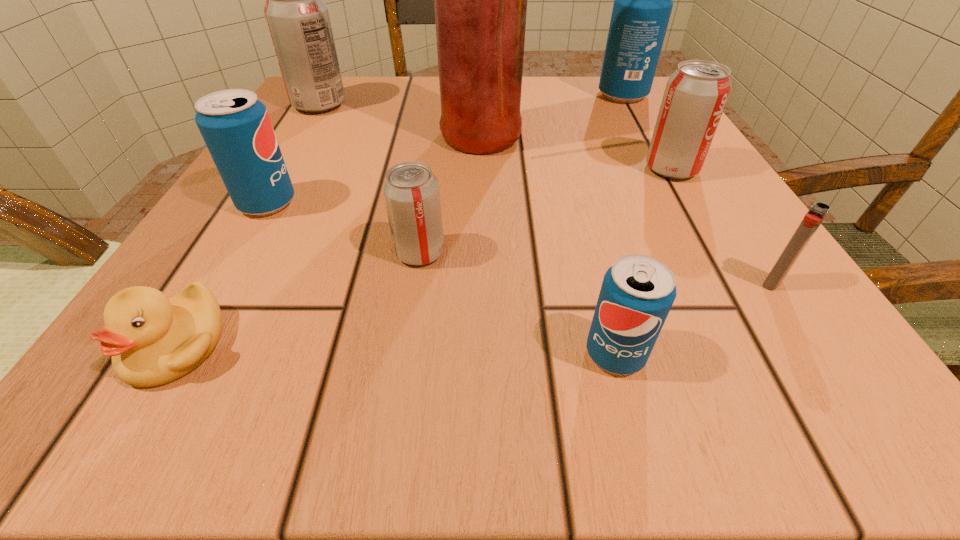
Where is `the nearest blue soda can`? the nearest blue soda can is located at coordinates (638, 291).

Image resolution: width=960 pixels, height=540 pixels. What are the coordinates of `the smallest blue soda can` in the screenshot? It's located at (638, 291).

Image resolution: width=960 pixels, height=540 pixels. Identify the location of the smallest gray soda can. (411, 191).

Find the location of a particular element. the third soda can from left to right is located at coordinates (411, 191).

The image size is (960, 540). Identify the location of igniter. (818, 211).

Find the location of `yellow duckling`. yellow duckling is located at coordinates [x=153, y=340].

Where is `duckling`? The image size is (960, 540). duckling is located at coordinates (153, 340).

Find the location of a particular element. This screenshot has height=540, width=960. vacant space located on the side of the tallest object with the label is located at coordinates (550, 140).

Where is `free spot located 0.400m on the front of the farthest blue soda can`? Image resolution: width=960 pixels, height=540 pixels. free spot located 0.400m on the front of the farthest blue soda can is located at coordinates 700,236.

The height and width of the screenshot is (540, 960). In order to click on vacant space located on the front of the biggest gray soda can in this screenshot , I will do `click(263, 200)`.